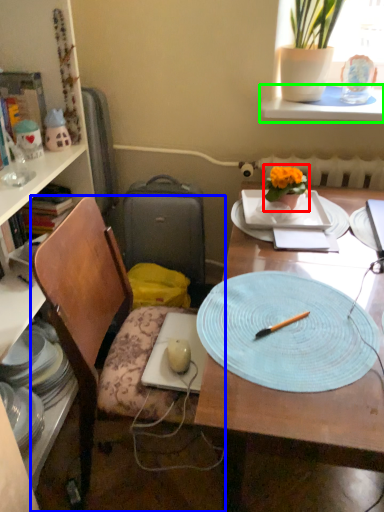
Question: Considering the real-world distances, which object is closest to houseplant (highlighted by a red box)? chair (highlighted by a blue box) or window sill (highlighted by a green box).

Choices:
 (A) chair
 (B) window sill

Answer: (B)